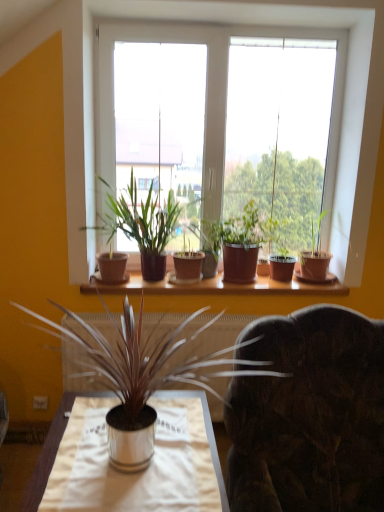
Question: From the image's perspective, is matte brown pot at center, the 3th houseplant in the front-to-back sequence, below brown clay pot at center, which is the 2th houseplant from front to back?

Choices:
 (A) no
 (B) yes

Answer: (B)

Question: Is matte brown pot at center, the third houseplant viewed from the back, smaller than brown clay pot at center, which is the 2th houseplant from front to back?

Choices:
 (A) yes
 (B) no

Answer: (A)

Question: Is matte brown pot at center, the 3th houseplant in the front-to-back sequence, taller than brown clay pot at center, which is the 2th houseplant from front to back?

Choices:
 (A) no
 (B) yes

Answer: (A)

Question: Is matte brown pot at center, the third houseplant viewed from the back, at the left side of brown clay pot at center, the fourth houseplant viewed from the back?

Choices:
 (A) yes
 (B) no

Answer: (B)

Question: From the image's perspective, is matte brown pot at center, the third houseplant viewed from the back, on top of brown clay pot at center, the fourth houseplant viewed from the back?

Choices:
 (A) no
 (B) yes

Answer: (A)

Question: Is silver metallic vase at center, the 1th houseplant when ordered from front to back, situated inside terracotta pot at center, which is the first houseplant in back-to-front order, or outside?

Choices:
 (A) outside
 (B) inside

Answer: (A)

Question: From a real-world perspective, relative to terracotta pot at center, marked as the fifth houseplant in a front-to-back arrangement, is silver metallic vase at center, the fifth houseplant in the back-to-front sequence, vertically above or below?

Choices:
 (A) below
 (B) above

Answer: (A)

Question: Looking at the image, does silver metallic vase at center, the fifth houseplant in the back-to-front sequence, seem bigger or smaller compared to terracotta pot at center, which is the first houseplant in back-to-front order?

Choices:
 (A) big
 (B) small

Answer: (A)

Question: Considering their positions, is silver metallic vase at center, the fifth houseplant in the back-to-front sequence, located in front of or behind terracotta pot at center, which is the first houseplant in back-to-front order?

Choices:
 (A) behind
 (B) front

Answer: (B)

Question: Considering the positions of point (24, 308) and point (268, 237), is point (24, 308) closer or farther from the camera than point (268, 237)?

Choices:
 (A) closer
 (B) farther

Answer: (A)

Question: Is silver metallic vase at center, the fifth houseplant in the back-to-front sequence, inside the boundaries of matte brown pot at center, the 3th houseplant in the front-to-back sequence, or outside?

Choices:
 (A) inside
 (B) outside

Answer: (B)

Question: Considering the relative positions of silver metallic vase at center, the 1th houseplant when ordered from front to back, and matte brown pot at center, the 3th houseplant in the front-to-back sequence, in the image provided, is silver metallic vase at center, the 1th houseplant when ordered from front to back, to the left or to the right of matte brown pot at center, the 3th houseplant in the front-to-back sequence,?

Choices:
 (A) right
 (B) left

Answer: (B)

Question: From the image's perspective, is silver metallic vase at center, the 1th houseplant when ordered from front to back, positioned above or below matte brown pot at center, the 3th houseplant in the front-to-back sequence?

Choices:
 (A) above
 (B) below

Answer: (B)

Question: Would you say terracotta pot at center, marked as the fifth houseplant in a front-to-back arrangement, is inside or outside silver metallic vase at center, the 1th houseplant when ordered from front to back?

Choices:
 (A) inside
 (B) outside

Answer: (B)

Question: From a real-world perspective, is terracotta pot at center, marked as the fifth houseplant in a front-to-back arrangement, positioned above or below silver metallic vase at center, the 1th houseplant when ordered from front to back?

Choices:
 (A) below
 (B) above

Answer: (B)